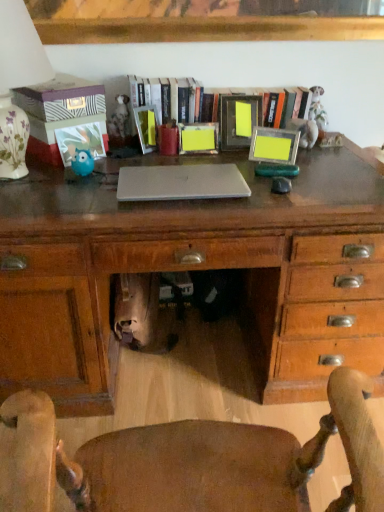
Locate an element on the screen. This screenshot has height=512, width=384. space that is in front of yellow matte picture frame at center, which appears as the third picture frame when viewed from the right is located at coordinates (195, 160).